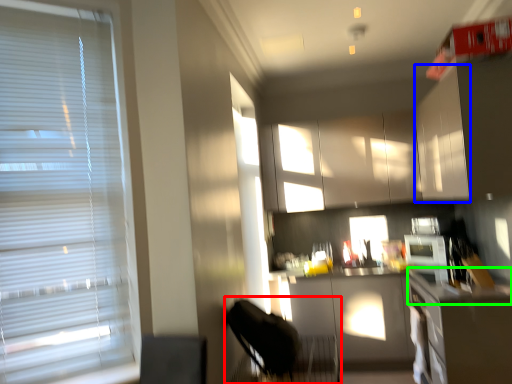
Question: Which object is the closest to the swivel chair (highlighted by a red box)? Choose among these: cabinetry (highlighted by a blue box) or counter top (highlighted by a green box).

Choices:
 (A) cabinetry
 (B) counter top

Answer: (B)